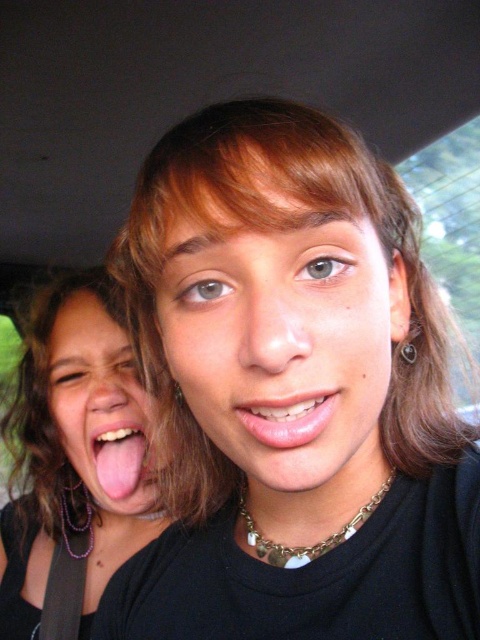
You are a photographer trying to focus on the matte black hair at center and the pink glossy lips at center in the image. Which object should you adjust your camera to focus on first if you want to capture both in a single shot?

The matte black hair at center is located below pink glossy lips at center, so you should focus on the pink glossy lips at center first to ensure both are in the frame.

You are a photographer standing 30 inches away from a matte skin face at lower left. Can you take a clear photo of it without moving closer?

The matte skin face at lower left is 26.49 inches from viewer. Since you are standing 30 inches away, you are 3.51 inches farther than the required distance, so you need to move closer to capture a clear photo.

You are a photographer trying to capture a closeup of the smooth skin face at center and the matte black hair at left. Since you want to focus on both subjects equally, which one should you position closer to the center of your camera frame?

The smooth skin face at center is already positioned on the right side of matte black hair at left, so to focus on both equally, you should center the camera frame between them.